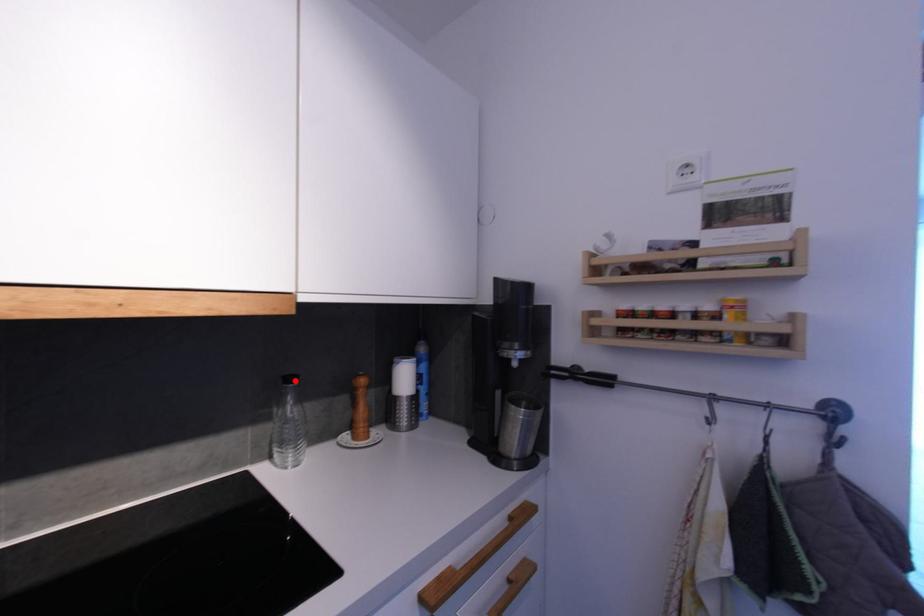
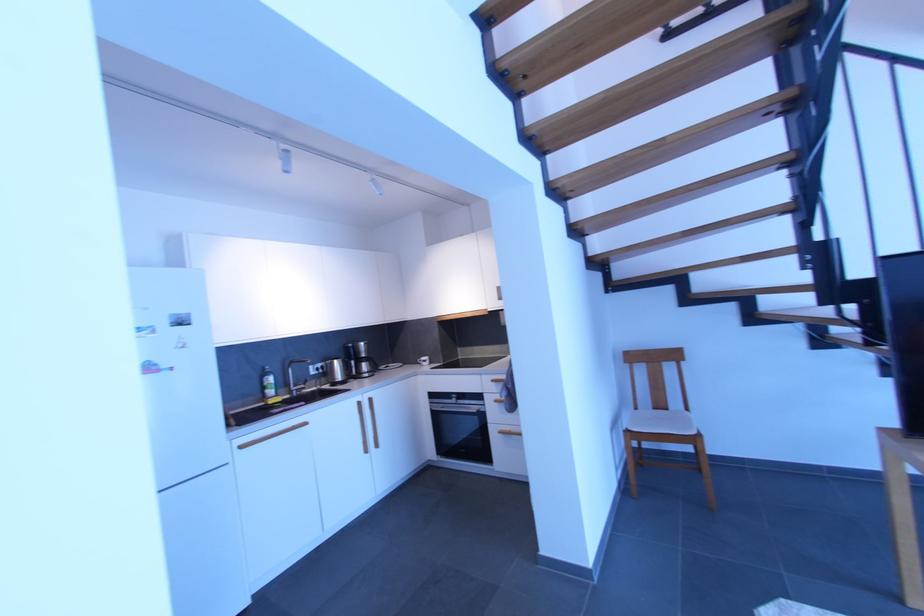
Question: I am providing you with two images of the same scene from different viewpoints. A red point is marked on the first image. Can you still see the location of the red point in image 2?

Choices:
 (A) Yes
 (B) No

Answer: (B)